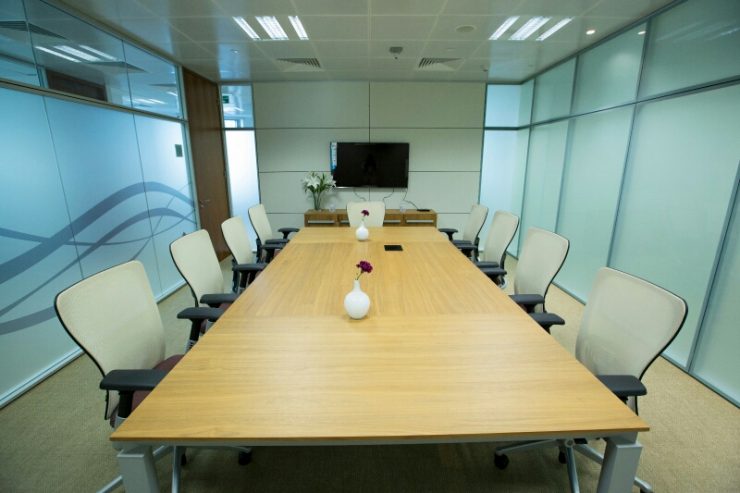
This screenshot has height=493, width=740. What are the coordinates of `the front edge of table` in the screenshot? It's located at (322, 440).